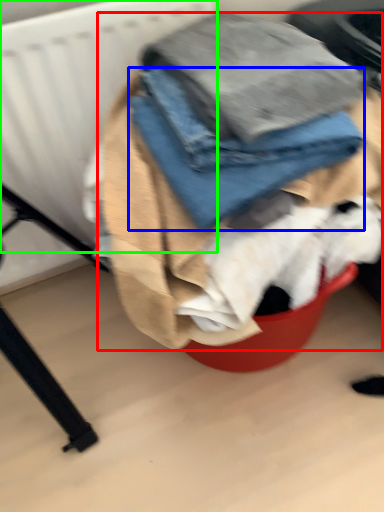
Question: Based on their relative distances, which object is nearer to laundry (highlighted by a red box)? Choose from trousers (highlighted by a blue box) and radiator (highlighted by a green box).

Choices:
 (A) trousers
 (B) radiator

Answer: (A)